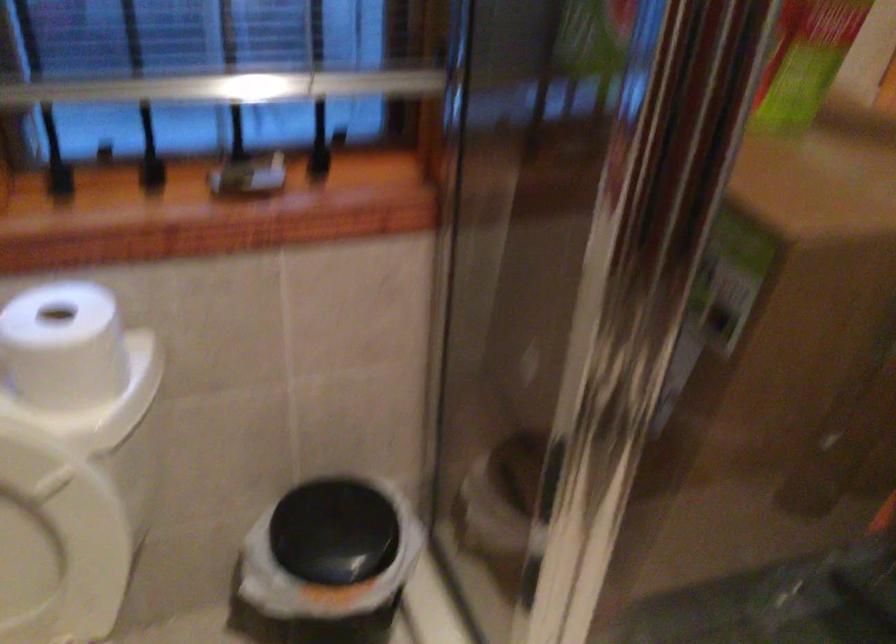
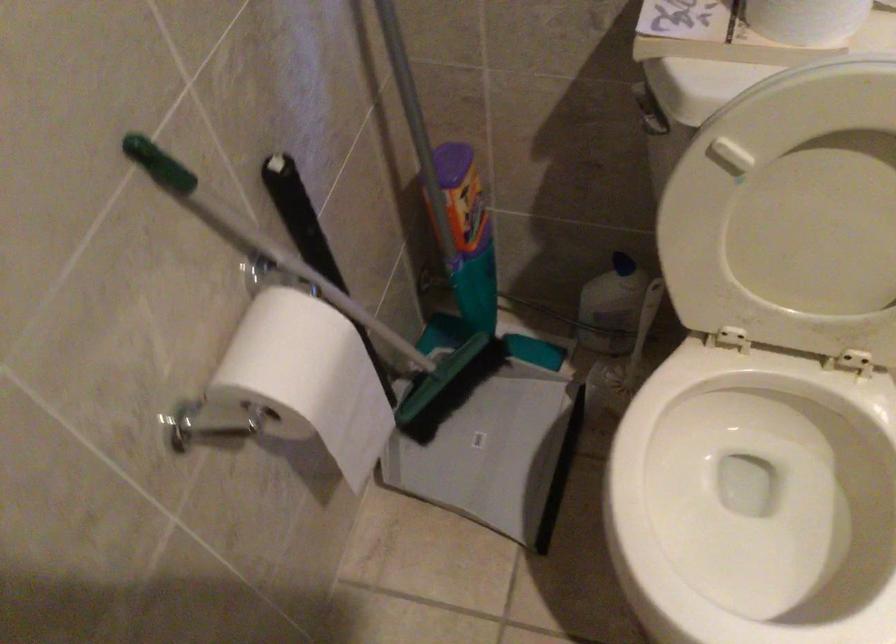
Consider the image. How did the camera likely rotate?

The rotation direction of the camera is left-down.